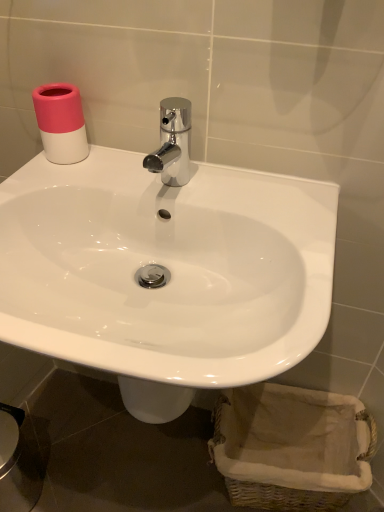
Question: Is chrome metallic faucet at center at the back of woven beige basket at lower right?

Choices:
 (A) no
 (B) yes

Answer: (A)

Question: Considering the relative sizes of woven beige basket at lower right and chrome metallic faucet at center in the image provided, is woven beige basket at lower right smaller than chrome metallic faucet at center?

Choices:
 (A) yes
 (B) no

Answer: (B)

Question: Is woven beige basket at lower right oriented towards chrome metallic faucet at center?

Choices:
 (A) no
 (B) yes

Answer: (A)

Question: Does woven beige basket at lower right come in front of chrome metallic faucet at center?

Choices:
 (A) yes
 (B) no

Answer: (B)

Question: Would you say woven beige basket at lower right is outside chrome metallic faucet at center?

Choices:
 (A) no
 (B) yes

Answer: (B)

Question: Does woven beige basket at lower right have a larger size compared to chrome metallic faucet at center?

Choices:
 (A) yes
 (B) no

Answer: (A)

Question: From a real-world perspective, is chrome metallic faucet at center over white glossy sink at center?

Choices:
 (A) yes
 (B) no

Answer: (A)

Question: Considering the relative positions of chrome metallic faucet at center and white glossy sink at center in the image provided, is chrome metallic faucet at center behind white glossy sink at center?

Choices:
 (A) yes
 (B) no

Answer: (A)

Question: Can we say chrome metallic faucet at center lies outside white glossy sink at center?

Choices:
 (A) yes
 (B) no

Answer: (A)

Question: From the image's perspective, is chrome metallic faucet at center under white glossy sink at center?

Choices:
 (A) no
 (B) yes

Answer: (A)

Question: Does chrome metallic faucet at center lie in front of white glossy sink at center?

Choices:
 (A) no
 (B) yes

Answer: (A)

Question: From the image's perspective, would you say chrome metallic faucet at center is positioned over white glossy sink at center?

Choices:
 (A) no
 (B) yes

Answer: (B)

Question: From the image's perspective, would you say white glossy sink at center is positioned over chrome metallic faucet at center?

Choices:
 (A) no
 (B) yes

Answer: (A)